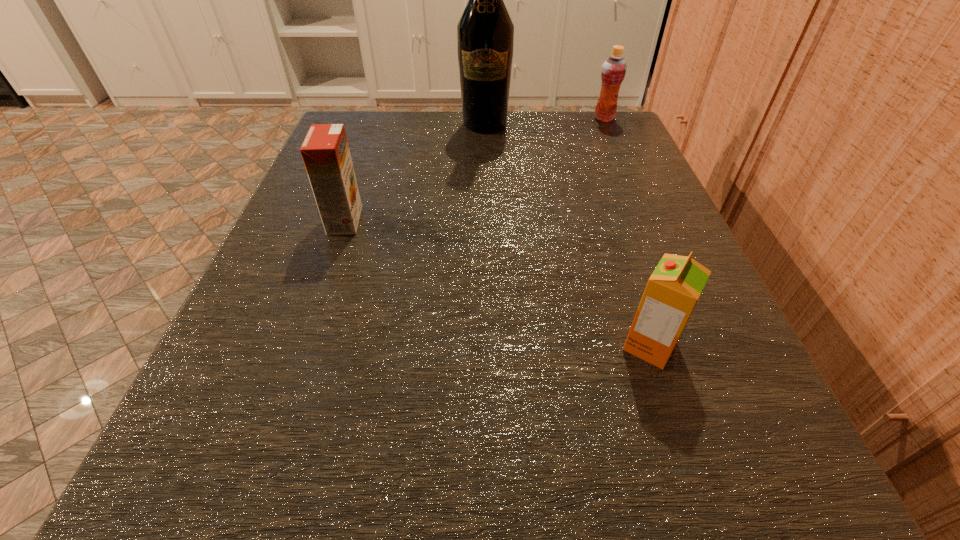
Locate an element on the screen. The image size is (960, 540). vacant space located 0.210m on the right of the second nearest object is located at coordinates (494, 220).

Locate an element on the screen. blank area located 0.290m on the back of the second object from right to left is located at coordinates (598, 190).

Identify the location of wine bottle that is at the far edge. (485, 33).

At what (x,y) coordinates should I click in order to perform the action: click on orange juice that is at the far edge. Please return your answer as a coordinate pair (x, y). Looking at the image, I should click on (614, 68).

You are a GUI agent. You are given a task and a screenshot of the screen. Output one action in this format:
    pyautogui.click(x=<x>, y=<y>)
    Task: Click on the object located at the left edge
    This screenshot has width=960, height=540.
    Given the screenshot: What is the action you would take?
    pyautogui.click(x=325, y=151)

Locate an element on the screen. The height and width of the screenshot is (540, 960). object present at the far right corner is located at coordinates (614, 68).

In the image, there is a desktop. At what (x,y) coordinates should I click in order to perform the action: click on vacant area at the far edge. Please return your answer as a coordinate pair (x, y). This screenshot has width=960, height=540. Looking at the image, I should click on (469, 131).

This screenshot has width=960, height=540. Identify the location of vacant space at the near edge. (393, 448).

At what (x,y) coordinates should I click in order to perform the action: click on vacant space at the left edge of the desktop. Please return your answer as a coordinate pair (x, y). Looking at the image, I should click on (212, 399).

The height and width of the screenshot is (540, 960). In order to click on vacant region at the right edge of the desktop in this screenshot , I will do `click(587, 283)`.